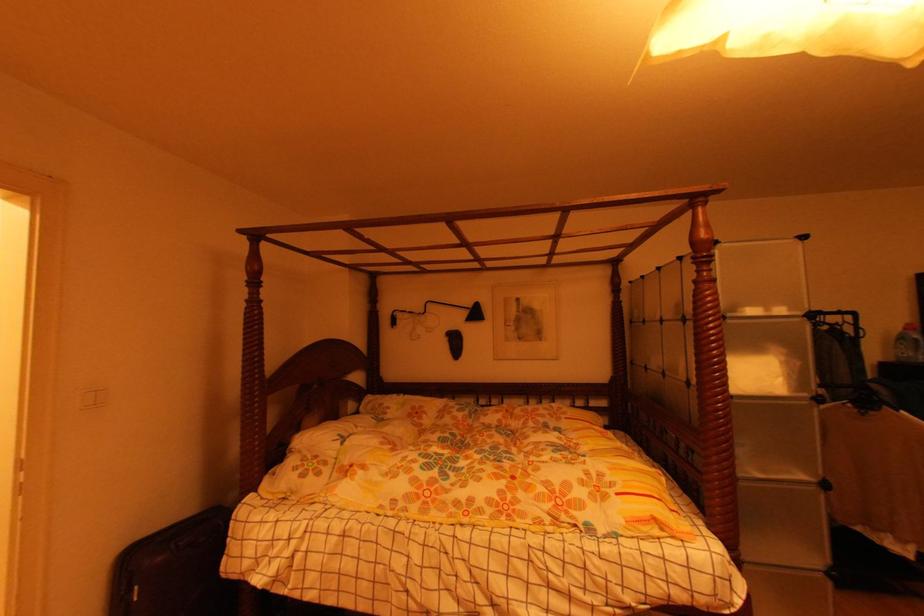
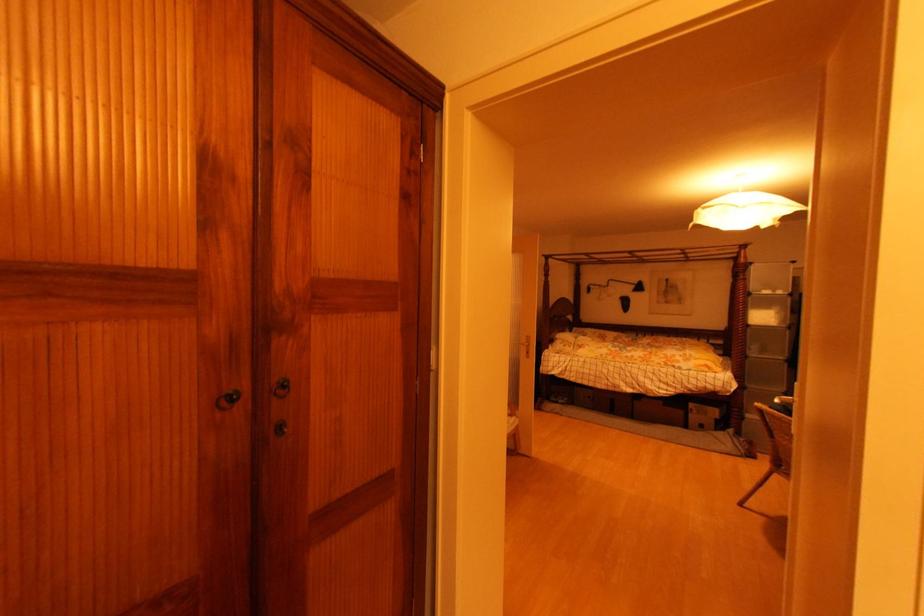
Where in the second image is the point corresponding to (784,312) from the first image?

(784, 294)